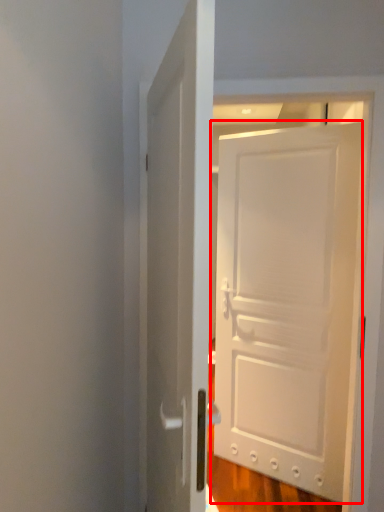
Question: From the image's perspective, where is door (annotated by the red box) located relative to door?

Choices:
 (A) below
 (B) above

Answer: (A)